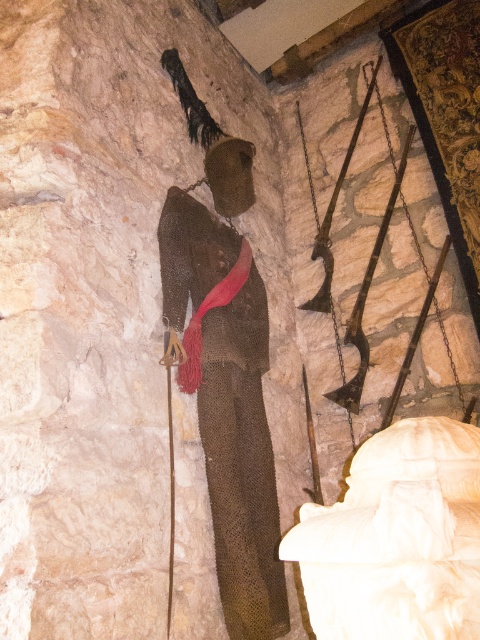
Question: Is gold chainmail suit at center wider than wooden ski pole at center?

Choices:
 (A) yes
 (B) no

Answer: (A)

Question: Is gold chainmail suit at center closer to camera compared to wooden ski pole at center?

Choices:
 (A) yes
 (B) no

Answer: (B)

Question: Can you confirm if gold chainmail suit at center is wider than wooden ski pole at center?

Choices:
 (A) no
 (B) yes

Answer: (B)

Question: Among these points, which one is nearest to the camera?

Choices:
 (A) (216, 141)
 (B) (168, 422)

Answer: (B)